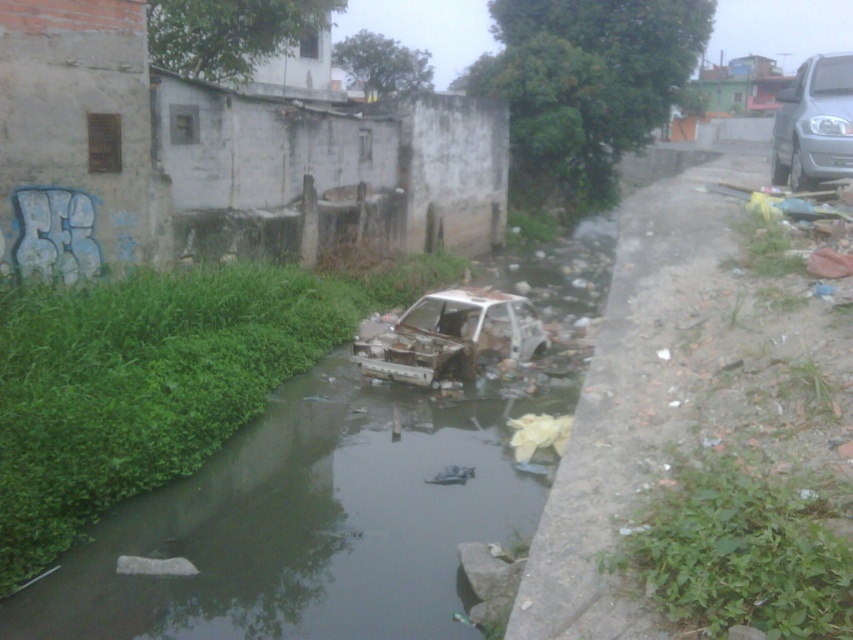
Question: Which object appears closest to the camera in this image?

Choices:
 (A) rusty metal car at center
 (B) silver metallic van at right

Answer: (B)

Question: Is rusty metal car at center thinner than silver metallic van at right?

Choices:
 (A) yes
 (B) no

Answer: (A)

Question: Observing the image, what is the correct spatial positioning of rusty metal car at center in reference to silver metallic van at right?

Choices:
 (A) below
 (B) above

Answer: (A)

Question: Can you confirm if rusty metal car at center is wider than silver metallic van at right?

Choices:
 (A) no
 (B) yes

Answer: (A)

Question: Among these points, which one is farthest from the camera?

Choices:
 (A) (817, 120)
 (B) (416, 333)

Answer: (B)